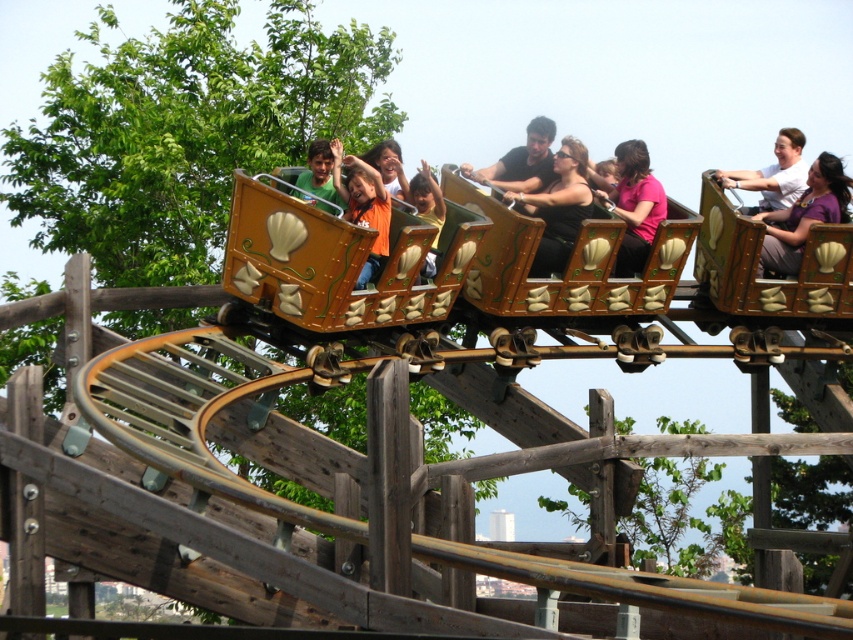
Question: Is purple matte shirt at upper right above pink fabric shirt at center?

Choices:
 (A) yes
 (B) no

Answer: (B)

Question: Can you confirm if wooden roller coaster at center is bigger than pink fabric shirt at center?

Choices:
 (A) yes
 (B) no

Answer: (A)

Question: Does purple matte shirt at upper right appear on the right side of matte brown wooden roller coaster car at upper center?

Choices:
 (A) yes
 (B) no

Answer: (B)

Question: Which object is farther from the camera taking this photo?

Choices:
 (A) matte orange shirt at center
 (B) black matte shirt at center
 (C) matte brown wooden roller coaster car at upper center
 (D) matte brown wooden boat at center

Answer: (C)

Question: Which object is farther from the camera taking this photo?

Choices:
 (A) wooden roller coaster at center
 (B) matte brown wooden roller coaster car at upper center
 (C) orange fabric shirt at center
 (D) matte green shirt at center

Answer: (B)

Question: Which object is closer to the camera taking this photo?

Choices:
 (A) pink fabric shirt at center
 (B) matte green shirt at center
 (C) black matte shirt at center

Answer: (B)